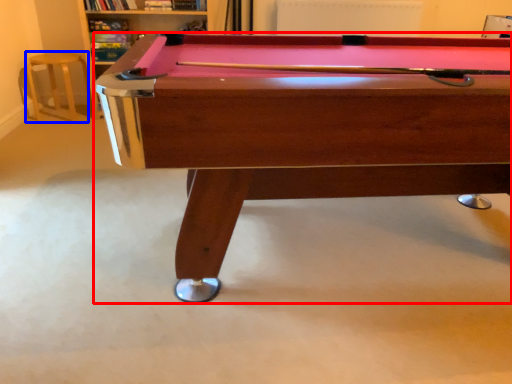
Question: Which of the following is the closest to the observer, billiard table (highlighted by a red box) or bar stool (highlighted by a blue box)?

Choices:
 (A) billiard table
 (B) bar stool

Answer: (A)